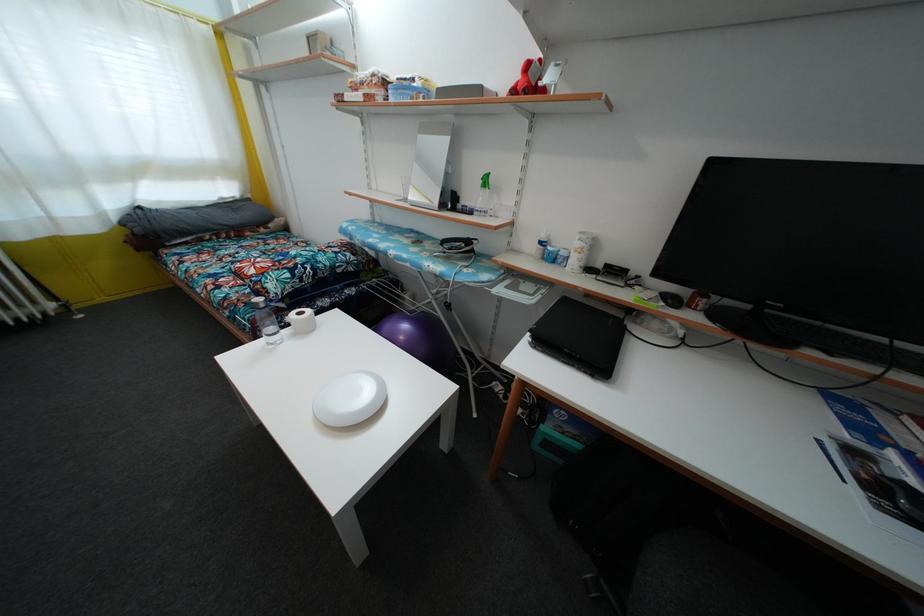
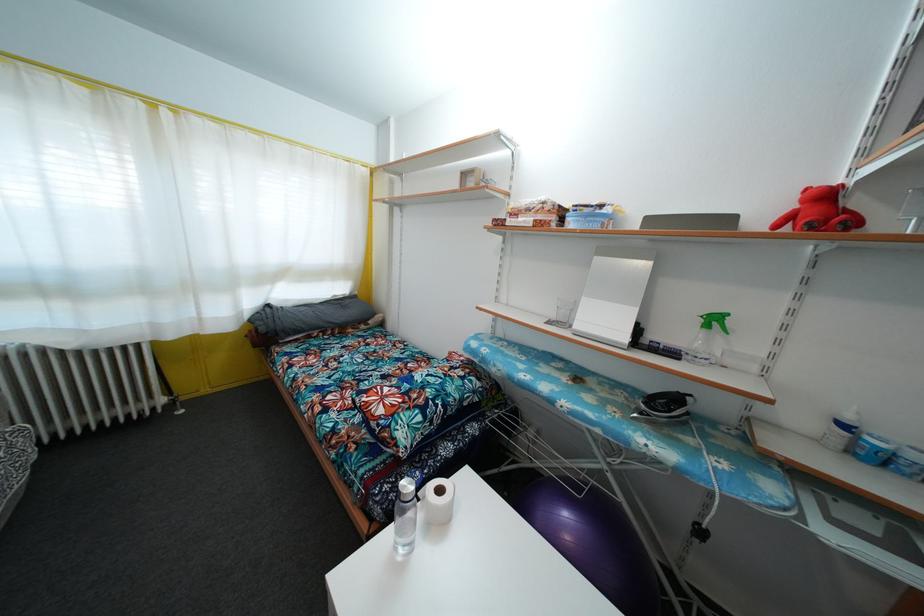
Locate, in the second image, the point that corresponds to (304,320) in the first image.

(444, 498)